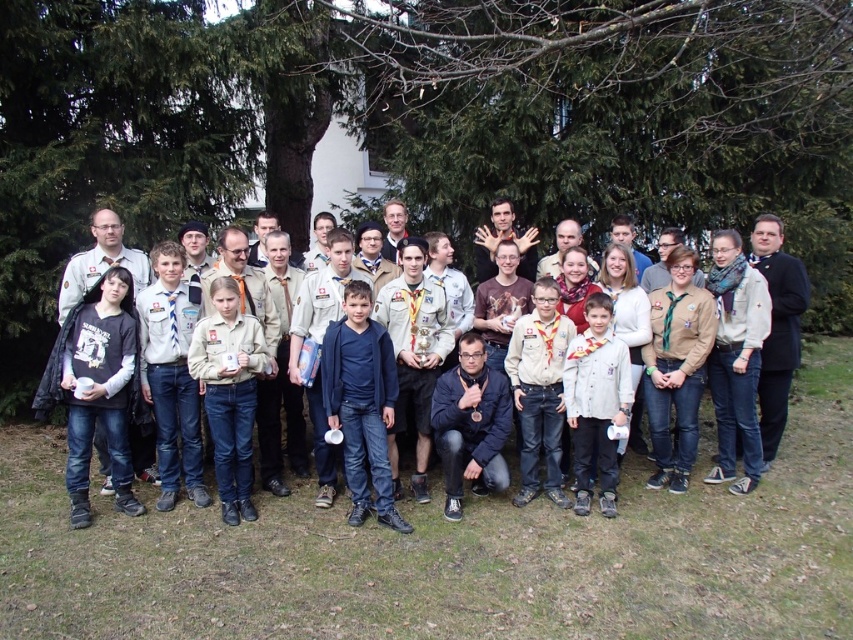
In the scene shown: You are a photographer trying to focus on the khaki uniform at center and the denim jeans at center in the group photo. Which of these two items is closer to your camera lens?

The khaki uniform at center is closer to the camera lens because it is further to the viewer than the denim jeans at center.

You are standing at the camera position and want to know how far the point at coordinates point (592, 412) is from you. Can you determine the distance?

The point at coordinates point (592, 412) is 6.36 meters away from the camera position.